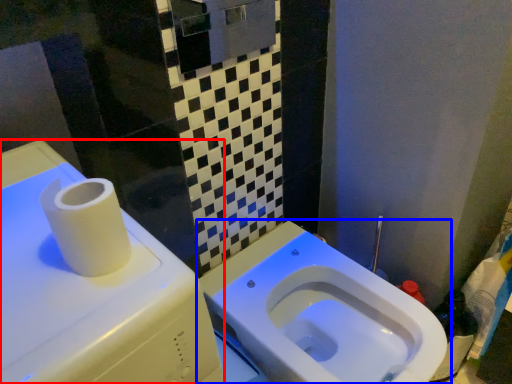
Question: Which point is further to the camera, water tank (highlighted by a red box) or toilet (highlighted by a blue box)?

Choices:
 (A) water tank
 (B) toilet

Answer: (B)